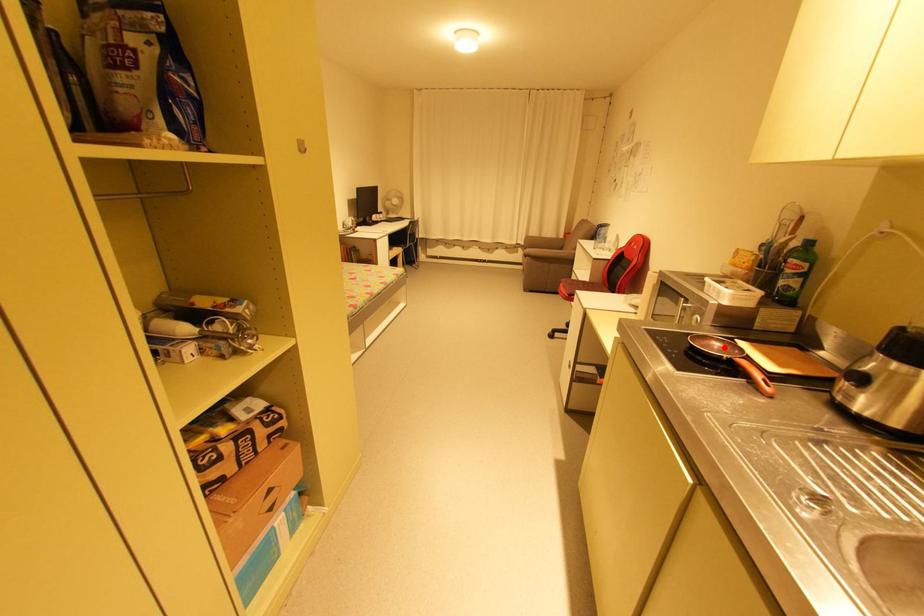
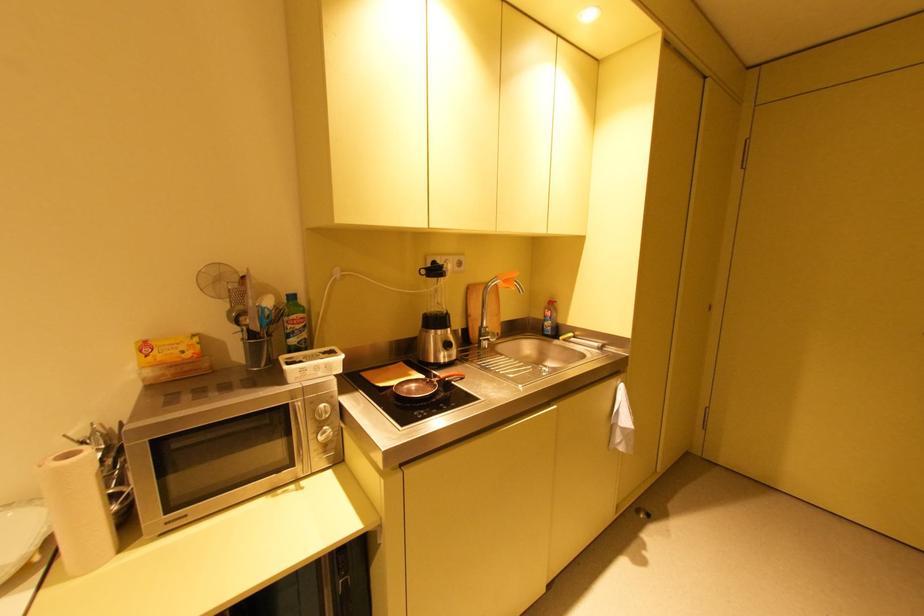
In the second image, find the point that corresponds to the highlighted location in the first image.

(420, 387)